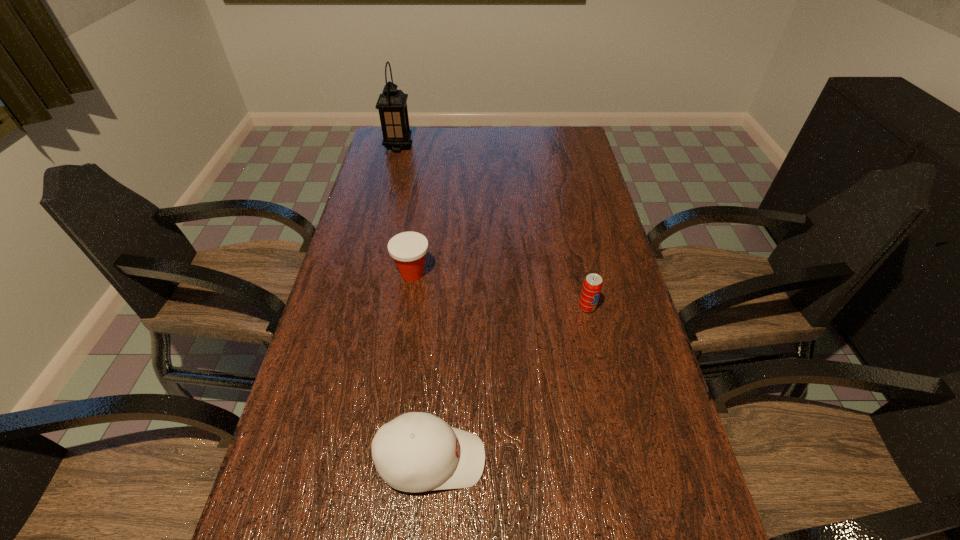
The image size is (960, 540). I want to click on the tallest object, so click(392, 104).

This screenshot has width=960, height=540. Find the location of `the farthest object`. the farthest object is located at coordinates (392, 104).

Identify the location of Dixie cup. (408, 249).

This screenshot has width=960, height=540. In order to click on the nearest object in this screenshot , I will do `click(416, 452)`.

Locate an element on the screen. soda can is located at coordinates (592, 285).

Locate an element on the screen. The image size is (960, 540). the third farthest object is located at coordinates (592, 285).

Where is `free region located on the right of the lantern`? The height and width of the screenshot is (540, 960). free region located on the right of the lantern is located at coordinates (503, 147).

Identify the location of free space located on the right of the Dixie cup. (571, 273).

The width and height of the screenshot is (960, 540). What are the coordinates of `vacant space located 0.380m on the front-facing side of the nearest object` in the screenshot? It's located at (673, 460).

Where is `free spot located 0.260m on the back of the rightmost object`? The image size is (960, 540). free spot located 0.260m on the back of the rightmost object is located at coordinates (571, 237).